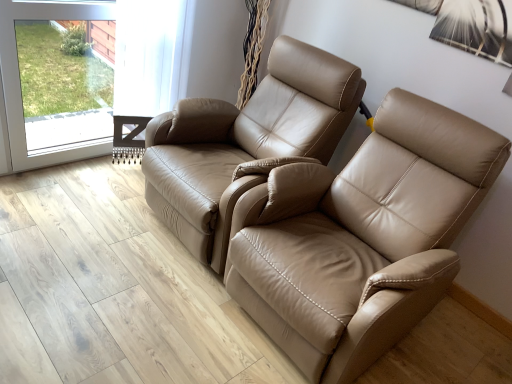
Image resolution: width=512 pixels, height=384 pixels. I want to click on tan leather chair at center, the first chair from the left, so click(x=244, y=142).

Describe the element at coordinates (244, 142) in the screenshot. The image size is (512, 384). I see `tan leather chair at center, arranged as the second chair when viewed from the right` at that location.

Image resolution: width=512 pixels, height=384 pixels. What do you see at coordinates (362, 237) in the screenshot?
I see `tan leather recliner at center, which appears as the first chair when viewed from the right` at bounding box center [362, 237].

At what (x,y) coordinates should I click in order to perform the action: click on tan leather chair at center, the first chair from the left. Please return your answer as a coordinate pair (x, y). Looking at the image, I should click on (244, 142).

Would you consider tan leather recliner at center, the second chair in the left-to-right sequence, to be distant from transparent glass screen door at upper left?

tan leather recliner at center, the second chair in the left-to-right sequence, is positioned a significant distance from transparent glass screen door at upper left.

From a real-world perspective, starting from the transparent glass screen door at upper left, which chair is the 1st one vertically above it? Please provide its 2D coordinates.

[(362, 237)]

From the image's perspective, is tan leather recliner at center, the second chair in the left-to-right sequence, over transparent glass screen door at upper left?

No, from the image's perspective, tan leather recliner at center, the second chair in the left-to-right sequence, is not above transparent glass screen door at upper left.

Does point (465, 222) come in front of point (14, 51)?

Yes, it is.

How many degrees apart are the facing directions of tan leather chair at center, arranged as the second chair when viewed from the right, and tan leather recliner at center, the second chair in the left-to-right sequence?

tan leather chair at center, arranged as the second chair when viewed from the right, and tan leather recliner at center, the second chair in the left-to-right sequence, are facing 0.000264 degrees away from each other.

From the image's perspective, is tan leather chair at center, the first chair from the left, over tan leather recliner at center, the second chair in the left-to-right sequence?

Yes, from the image's perspective, tan leather chair at center, the first chair from the left, is on top of tan leather recliner at center, the second chair in the left-to-right sequence.

From a real-world perspective, is tan leather chair at center, arranged as the second chair when viewed from the right, on tan leather recliner at center, which appears as the first chair when viewed from the right?

Correct, in the physical world, tan leather chair at center, arranged as the second chair when viewed from the right, is higher than tan leather recliner at center, which appears as the first chair when viewed from the right.

Is tan leather recliner at center, the second chair in the left-to-right sequence, positioned before tan leather chair at center, arranged as the second chair when viewed from the right?

Yes, it is in front of tan leather chair at center, arranged as the second chair when viewed from the right.

Considering the relative sizes of tan leather recliner at center, the second chair in the left-to-right sequence, and tan leather chair at center, the first chair from the left, in the image provided, is tan leather recliner at center, the second chair in the left-to-right sequence, shorter than tan leather chair at center, the first chair from the left,?

No.

Between tan leather recliner at center, the second chair in the left-to-right sequence, and tan leather chair at center, the first chair from the left, which one appears on the right side from the viewer's perspective?

Positioned to the right is tan leather recliner at center, the second chair in the left-to-right sequence.

Which of these two, transparent glass screen door at upper left or tan leather chair at center, the first chair from the left, is wider?

Wider between the two is tan leather chair at center, the first chair from the left.

Where is `screen door located underneath the tan leather chair at center, arranged as the second chair when viewed from the right (from a real-world perspective)`? Image resolution: width=512 pixels, height=384 pixels. screen door located underneath the tan leather chair at center, arranged as the second chair when viewed from the right (from a real-world perspective) is located at coordinates (19, 82).

Which of these two, transparent glass screen door at upper left or tan leather chair at center, the first chair from the left, stands taller?

Standing taller between the two is tan leather chair at center, the first chair from the left.

Does point (8, 117) come closer to viewer compared to point (179, 179)?

That is False.

Is point (0, 57) positioned before point (365, 262)?

No, (0, 57) is behind (365, 262).

The image size is (512, 384). What are the coordinates of `screen door below the tan leather recliner at center, which appears as the first chair when viewed from the right (from a real-world perspective)` in the screenshot? It's located at (19, 82).

Based on the photo, which object is wider, transparent glass screen door at upper left or tan leather recliner at center, the second chair in the left-to-right sequence?

tan leather recliner at center, the second chair in the left-to-right sequence.

Which is correct: transparent glass screen door at upper left is inside tan leather recliner at center, the second chair in the left-to-right sequence, or outside of it?

transparent glass screen door at upper left is not enclosed by tan leather recliner at center, the second chair in the left-to-right sequence.

From a real-world perspective, is tan leather chair at center, arranged as the second chair when viewed from the right, located beneath transparent glass screen door at upper left?

No, from a real-world perspective, tan leather chair at center, arranged as the second chair when viewed from the right, is not below transparent glass screen door at upper left.

Could you tell me if tan leather chair at center, arranged as the second chair when viewed from the right, is facing transparent glass screen door at upper left?

No, tan leather chair at center, arranged as the second chair when viewed from the right, does not turn towards transparent glass screen door at upper left.

Is tan leather chair at center, the first chair from the left, far from transparent glass screen door at upper left?

tan leather chair at center, the first chair from the left, is actually quite close to transparent glass screen door at upper left.

Where is `screen door behind the tan leather chair at center, arranged as the second chair when viewed from the right`? This screenshot has height=384, width=512. screen door behind the tan leather chair at center, arranged as the second chair when viewed from the right is located at coordinates (19, 82).

Identify the location of screen door behind the tan leather recliner at center, the second chair in the left-to-right sequence. (19, 82).

At what (x,y) coordinates should I click in order to perform the action: click on chair lying above the tan leather recliner at center, the second chair in the left-to-right sequence (from the image's perspective). Please return your answer as a coordinate pair (x, y). Image resolution: width=512 pixels, height=384 pixels. Looking at the image, I should click on (244, 142).

When comparing their distances from transparent glass screen door at upper left, does tan leather chair at center, arranged as the second chair when viewed from the right, or tan leather recliner at center, the second chair in the left-to-right sequence, seem further?

tan leather recliner at center, the second chair in the left-to-right sequence, is positioned further to the anchor transparent glass screen door at upper left.

Looking at the image, which one is located closer to transparent glass screen door at upper left, tan leather recliner at center, the second chair in the left-to-right sequence, or tan leather chair at center, the first chair from the left?

The object closer to transparent glass screen door at upper left is tan leather chair at center, the first chair from the left.

Based on their spatial positions, is tan leather recliner at center, the second chair in the left-to-right sequence, or transparent glass screen door at upper left further from tan leather chair at center, the first chair from the left?

transparent glass screen door at upper left.

Considering their positions, is tan leather chair at center, arranged as the second chair when viewed from the right, positioned closer to tan leather recliner at center, the second chair in the left-to-right sequence, than transparent glass screen door at upper left?

tan leather chair at center, arranged as the second chair when viewed from the right, lies closer to tan leather recliner at center, the second chair in the left-to-right sequence, than the other object.

From the image, which object appears to be nearer to tan leather recliner at center, the second chair in the left-to-right sequence, transparent glass screen door at upper left or tan leather chair at center, arranged as the second chair when viewed from the right?

tan leather chair at center, arranged as the second chair when viewed from the right, is positioned closer to the anchor tan leather recliner at center, the second chair in the left-to-right sequence.

Based on their spatial positions, is transparent glass screen door at upper left or tan leather recliner at center, which appears as the first chair when viewed from the right, further from tan leather chair at center, arranged as the second chair when viewed from the right?

transparent glass screen door at upper left.

Identify the location of chair situated between transparent glass screen door at upper left and tan leather recliner at center, which appears as the first chair when viewed from the right, from left to right. (244, 142).